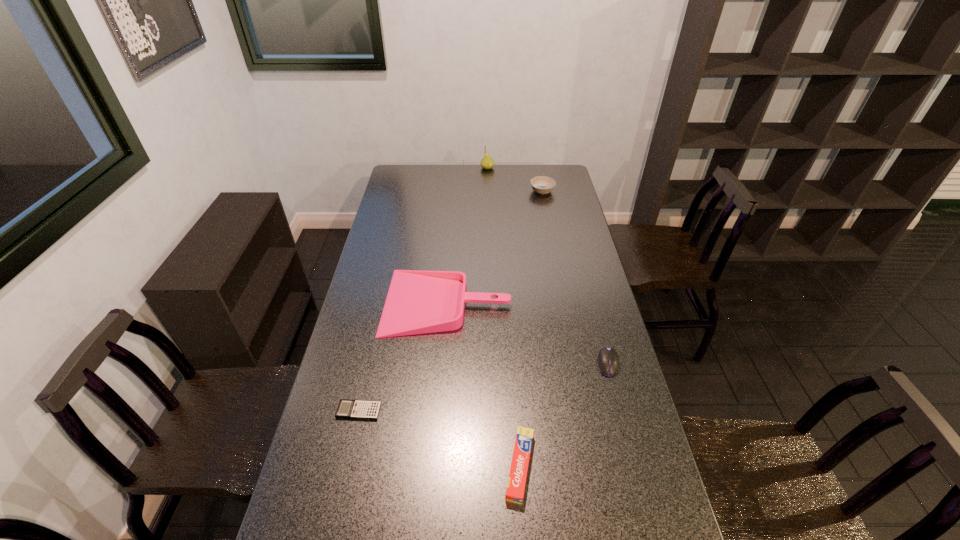
Where is `unoccupied position between the toothpaste and the farthest object`? The image size is (960, 540). unoccupied position between the toothpaste and the farthest object is located at coordinates (504, 317).

Image resolution: width=960 pixels, height=540 pixels. In order to click on free spot between the bowl and the toothpaste in this screenshot , I will do `click(531, 329)`.

I want to click on blank region between the third farthest object and the toothpaste, so click(x=483, y=384).

You are a GUI agent. You are given a task and a screenshot of the screen. Output one action in this format:
    pyautogui.click(x=<x>, y=<y>)
    Task: Click on the vacant space that's between the rightmost object and the nearest object
    Image resolution: width=960 pixels, height=540 pixels.
    Given the screenshot: What is the action you would take?
    pyautogui.click(x=564, y=415)

Identify the location of blank region between the calculator and the dustpan. (403, 356).

The width and height of the screenshot is (960, 540). I want to click on vacant area that lies between the toothpaste and the tallest object, so click(504, 317).

The height and width of the screenshot is (540, 960). In order to click on free space between the fourth nearest object and the second object from right to left in this screenshot , I will do `click(494, 246)`.

Find the location of a particular element. Image resolution: width=960 pixels, height=540 pixels. object that stands as the fourth closest to the fifth nearest object is located at coordinates (516, 483).

Point out which object is positioned as the fourth nearest to the bowl. Please provide its 2D coordinates. Your answer should be formatted as a tuple, i.e. [(x, y)], where the tuple contains the x and y coordinates of a point satisfying the conditions above.

[(516, 483)]

This screenshot has height=540, width=960. In order to click on blank space that satisfies the following two spatial constraints: 1. on the handle side of the computer mouse; 2. on the right side of the third farthest object in this screenshot , I will do `click(443, 363)`.